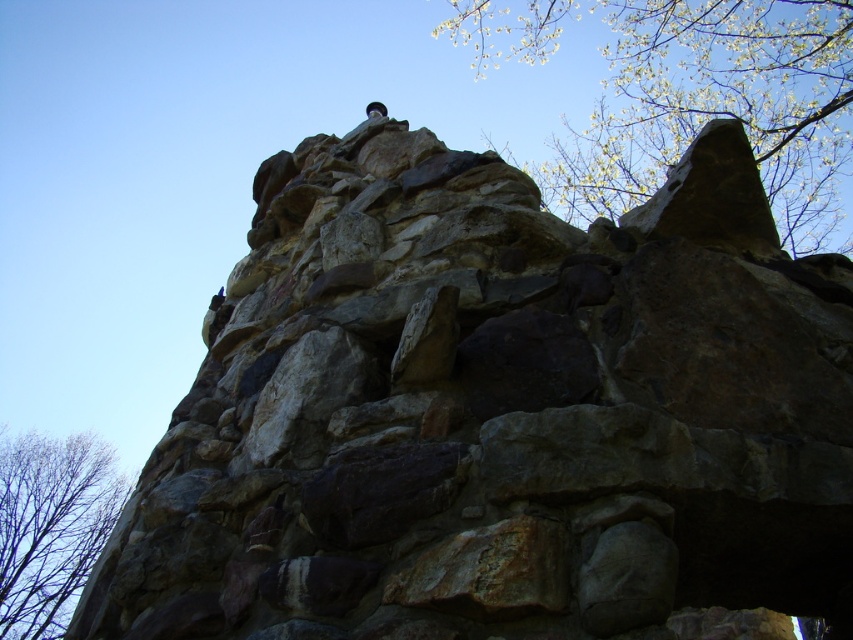
Question: Is green leafy tree at upper right positioned at the back of bare branches at lower left?

Choices:
 (A) yes
 (B) no

Answer: (B)

Question: Does green leafy tree at upper right appear under bare branches at lower left?

Choices:
 (A) no
 (B) yes

Answer: (A)

Question: Considering the relative positions of green leafy tree at upper right and bare branches at lower left in the image provided, where is green leafy tree at upper right located with respect to bare branches at lower left?

Choices:
 (A) right
 (B) left

Answer: (A)

Question: Which object is closer to the camera taking this photo?

Choices:
 (A) bare branches at lower left
 (B) green leafy tree at upper right

Answer: (B)

Question: Which point appears closest to the camera in this image?

Choices:
 (A) (845, 112)
 (B) (84, 467)

Answer: (A)

Question: Which point is farther to the camera?

Choices:
 (A) green leafy tree at upper right
 (B) bare branches at lower left

Answer: (B)